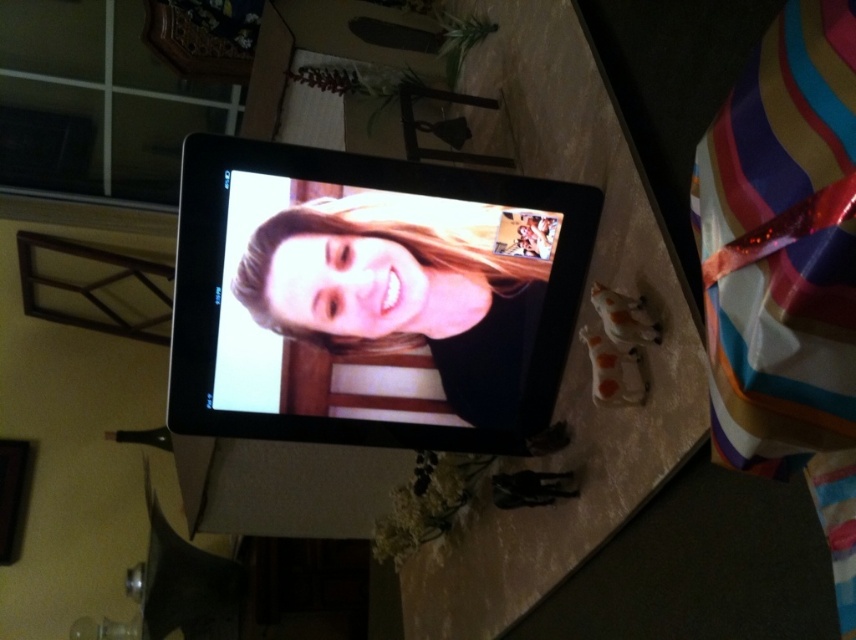
Does matte black screen at center have a smaller size compared to matte skin face at center?

Incorrect, matte black screen at center is not smaller in size than matte skin face at center.

In the scene shown: Who is more distant from viewer, [389,387] or [272,292]?

Point [389,387]

Who is more distant from viewer, (447, 404) or (421, 284)?

The point (447, 404) is behind.

Identify the location of matte black screen at center. (396, 301).